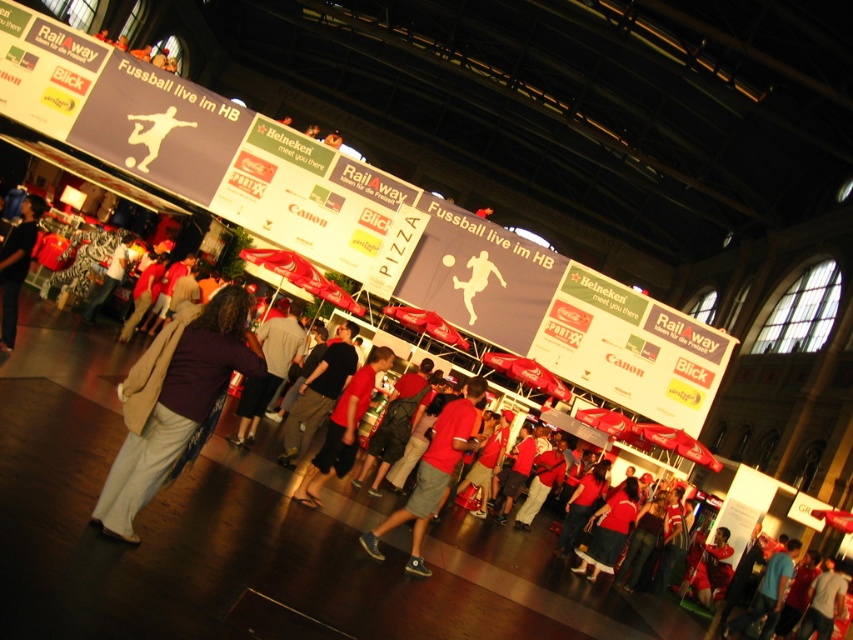
This screenshot has width=853, height=640. What do you see at coordinates (175, 403) in the screenshot?
I see `purple matte shirt at lower left` at bounding box center [175, 403].

Does point (242, 336) lie behind point (376, 554)?

No.

Find the location of a particular element. The width and height of the screenshot is (853, 640). purple matte shirt at lower left is located at coordinates (175, 403).

Is purple matte shirt at lower left positioned in front of dark gray jacket at left?

Yes, purple matte shirt at lower left is in front of dark gray jacket at left.

Which is behind, point (252, 374) or point (15, 333)?

The point (15, 333) is behind.

Is point (233, 324) positioned before point (21, 280)?

That is True.

Identify the location of purple matte shirt at lower left. (175, 403).

Is red cotton t-shirt at center smaller than red cotton shirt at center?

Incorrect, red cotton t-shirt at center is not smaller in size than red cotton shirt at center.

Does point (467, 417) come closer to viewer compared to point (364, 364)?

Yes.

Is point (419, 541) positioned before point (316, 468)?

Yes, point (419, 541) is in front of point (316, 468).

The width and height of the screenshot is (853, 640). Find the location of `red cotton t-shirt at center`. red cotton t-shirt at center is located at coordinates (432, 474).